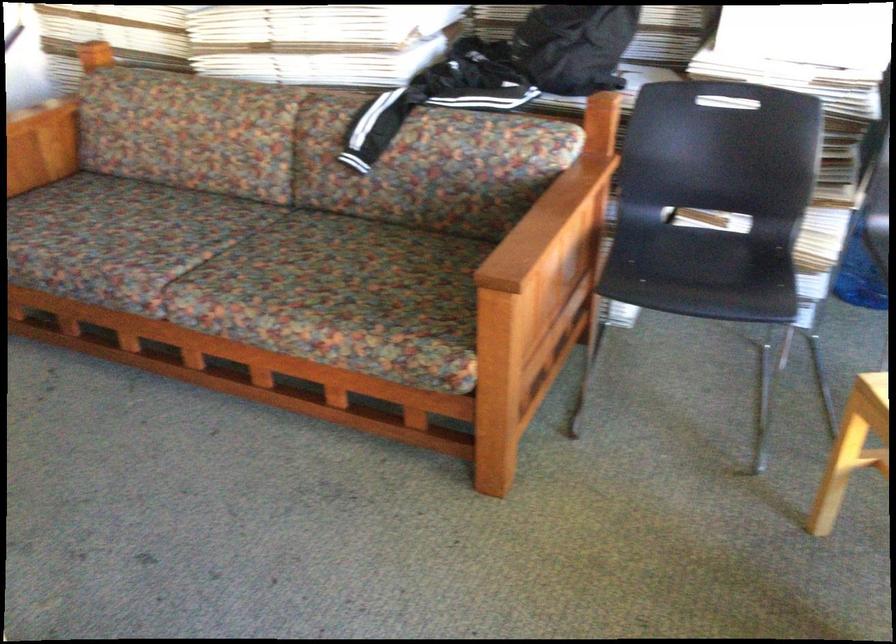
Where would you sit the chair sitting surface? Please return your answer as a coordinate pair (x, y).

(701, 272)